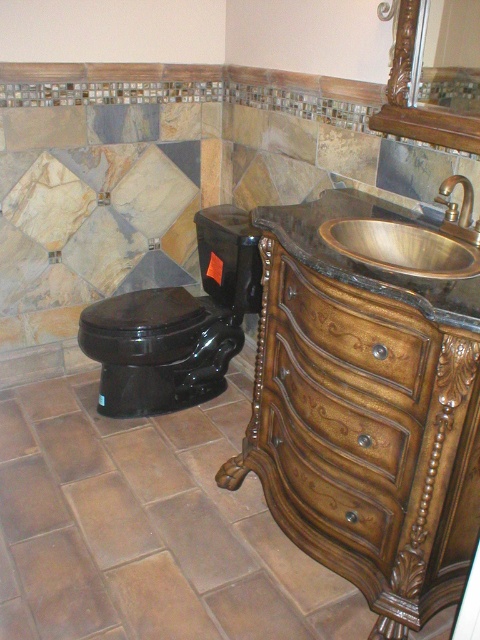
You are a delivery person trying to place a package that is 2 feet wide between the brown wood dresser at lower right and the glossy wood mirror at upper right. Can the package fit in the space between them?

The distance between the brown wood dresser at lower right and the glossy wood mirror at upper right is 26.07 inches, which is approximately 2.17 feet. Since the package is 2 feet wide, it can fit in the space between them.

You are designing a layout for a bathroom and need to place a new plant stand between the brown wood dresser at lower right and the glossy wood mirror at upper right. Which object should the plant stand be closer to if it needs to be placed near the wider object?

The brown wood dresser at lower right might be wider than the glossy wood mirror at upper right, so the plant stand should be placed closer to the brown wood dresser at lower right.

You are a delivery person bringing a package that is 1.2 meters long to the bathroom. The package needs to be placed between the black glossy toilet and the brown wood dresser at lower right. Can you fit the package in that space?

The distance between the black glossy toilet and the brown wood dresser at lower right is 1.17 meters. Since the package is 1.2 meters long, it cannot fit in the space between them.